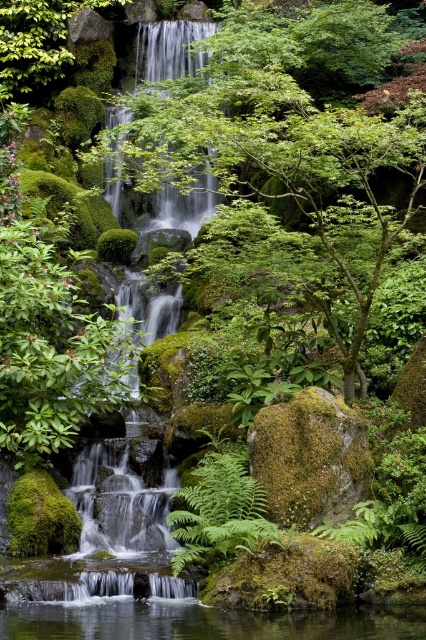
Between green mossy rock at center and green mossy waterfall at upper center, which one has more height?

green mossy waterfall at upper center is taller.

Locate an element on the screen. The image size is (426, 640). green mossy rock at center is located at coordinates (310, 458).

Does green mossy rock at center appear on the right side of green leafy fern at center?

Correct, you'll find green mossy rock at center to the right of green leafy fern at center.

Can you confirm if green mossy rock at center is smaller than green leafy fern at center?

No.

The height and width of the screenshot is (640, 426). In order to click on green mossy rock at center in this screenshot , I will do `click(310, 458)`.

Who is positioned more to the right, green leafy tree at center or clear water at center?

Positioned to the right is green leafy tree at center.

In order to click on green leafy tree at center in this screenshot , I will do `click(287, 161)`.

Is point (339, 332) less distant than point (365, 605)?

No, it is behind (365, 605).

Find the location of `green leafy tree at center`. green leafy tree at center is located at coordinates (287, 161).